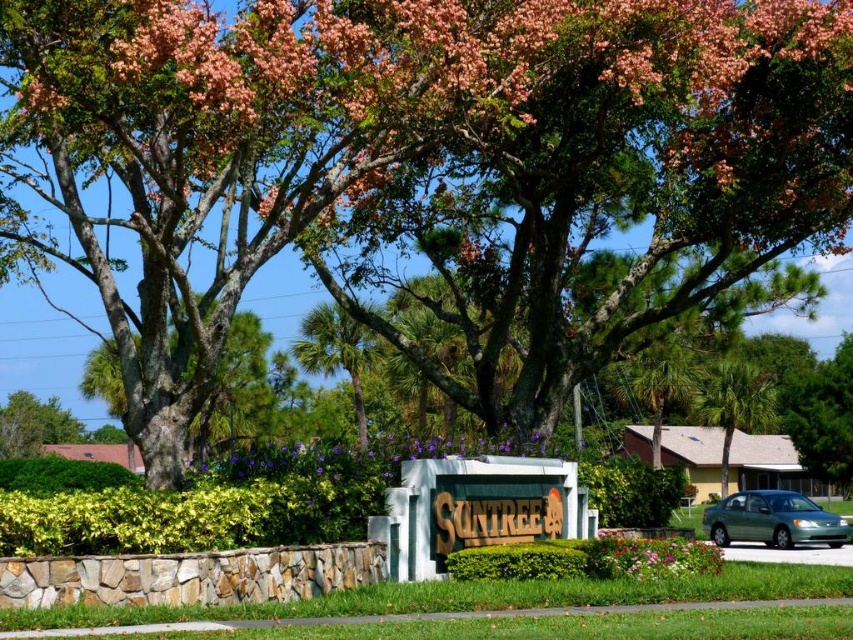
Between multicolored fabric flower at lower center and green leafy tree at upper left, which one appears on the left side from the viewer's perspective?

From the viewer's perspective, green leafy tree at upper left appears more on the left side.

Does point (672, 554) come farther from viewer compared to point (21, 445)?

No, (672, 554) is in front of (21, 445).

The width and height of the screenshot is (853, 640). I want to click on multicolored fabric flower at lower center, so click(648, 556).

From the picture: Does purple matte flowers at center have a greater height compared to green matte sedan at lower right?

Result: Incorrect, purple matte flowers at center's height is not larger of green matte sedan at lower right's.

Is purple matte flowers at center positioned in front of green matte sedan at lower right?

Yes, purple matte flowers at center is in front of green matte sedan at lower right.

The image size is (853, 640). I want to click on purple matte flowers at center, so click(x=326, y=460).

Does green matte sedan at lower right appear on the left side of green leafy tree at upper left?

In fact, green matte sedan at lower right is to the right of green leafy tree at upper left.

Describe the element at coordinates (772, 520) in the screenshot. I see `green matte sedan at lower right` at that location.

You are a GUI agent. You are given a task and a screenshot of the screen. Output one action in this format:
    pyautogui.click(x=<x>, y=<y>)
    Task: Click on the green matte sedan at lower right
    The image size is (853, 640).
    Given the screenshot: What is the action you would take?
    pyautogui.click(x=772, y=520)